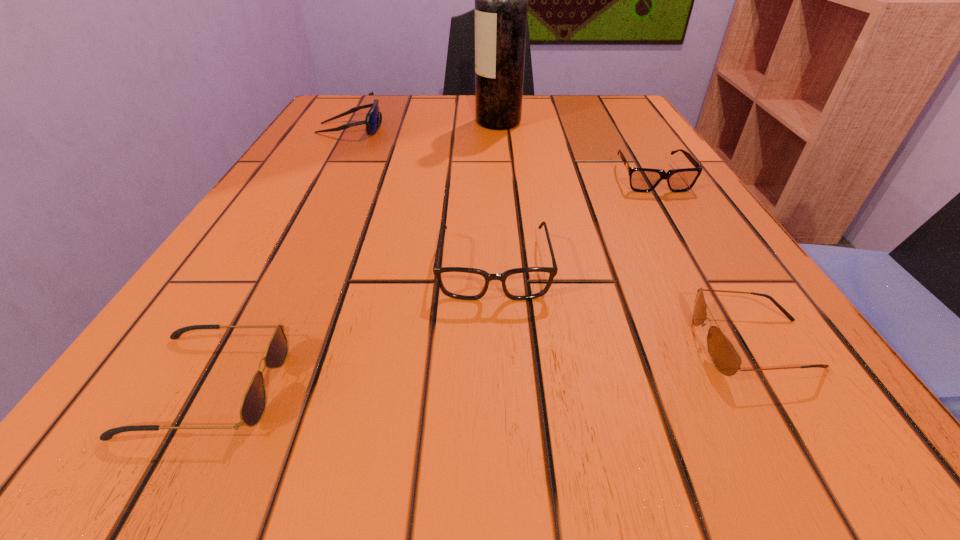
This screenshot has height=540, width=960. Find the location of `vacant space at the near left corner of the desktop`. vacant space at the near left corner of the desktop is located at coordinates (259, 433).

You are a GUI agent. You are given a task and a screenshot of the screen. Output one action in this format:
    pyautogui.click(x=<x>, y=<y>)
    Task: Click on the free spot at the far right corner of the desktop
    The image size is (960, 540).
    Given the screenshot: What is the action you would take?
    pyautogui.click(x=614, y=116)

You are a GUI agent. You are given a task and a screenshot of the screen. Output one action in this format:
    pyautogui.click(x=<x>, y=<y>)
    Task: Click on the blank space at the near right corner of the desktop
    The height and width of the screenshot is (540, 960).
    Given the screenshot: What is the action you would take?
    pyautogui.click(x=861, y=423)

Image resolution: width=960 pixels, height=540 pixels. I want to click on empty space that is in between the liquor and the second farthest sunglasses, so click(575, 150).

Where is `free space between the third nearest object and the tallest sunglasses`? free space between the third nearest object and the tallest sunglasses is located at coordinates (422, 198).

Locate an element on the screen. Image resolution: width=960 pixels, height=540 pixels. free space between the second farthest sunglasses and the fourth farthest object is located at coordinates (572, 222).

Locate which object ranks in proximity to the farthest sunglasses. Please provide its 2D coordinates. Your answer should be formatted as a tuple, i.e. [(x, y)], where the tuple contains the x and y coordinates of a point satisfying the conditions above.

[(501, 0)]

Locate an element on the screen. Image resolution: width=960 pixels, height=540 pixels. object that is the fourth closest to the tallest object is located at coordinates (723, 354).

Identify which sunglasses is located as the fourth nearest to the spectacles. Please provide its 2D coordinates. Your answer should be formatted as a tuple, i.e. [(x, y)], where the tuple contains the x and y coordinates of a point satisfying the conditions above.

[(373, 119)]

Where is `sunglasses that is the third closest to the tallest object`? This screenshot has width=960, height=540. sunglasses that is the third closest to the tallest object is located at coordinates (723, 354).